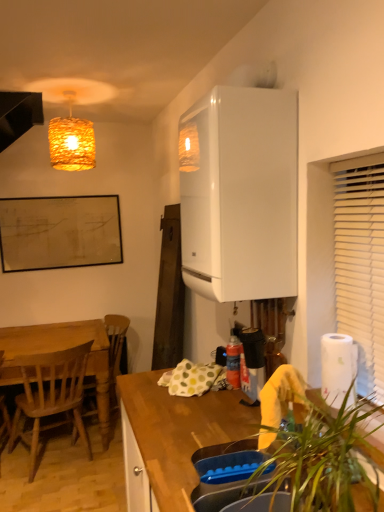
The width and height of the screenshot is (384, 512). What are the coordinates of `white glossy boiler at upper right` in the screenshot? It's located at (240, 194).

Find the location of a particular element. This screenshot has width=384, height=512. wooden chair at left, the first chair when ordered from back to front is located at coordinates (116, 343).

From the image's perspective, which one is positioned lower, woven straw lampshade at upper left or white glossy boiler at upper right?

From the image's view, white glossy boiler at upper right is below.

Is woven straw lampshade at upper left inside the boundaries of white glossy boiler at upper right, or outside?

woven straw lampshade at upper left is not enclosed by white glossy boiler at upper right.

Considering the relative positions of woven straw lampshade at upper left and white glossy boiler at upper right in the image provided, is woven straw lampshade at upper left to the left of white glossy boiler at upper right from the viewer's perspective?

Indeed, woven straw lampshade at upper left is positioned on the left side of white glossy boiler at upper right.

Considering the relative sizes of woven straw lampshade at upper left and white glossy boiler at upper right in the image provided, is woven straw lampshade at upper left taller than white glossy boiler at upper right?

No.

Considering the sizes of objects wooden at lower right and black matte exhaust hood at upper left in the image provided, who is taller, wooden at lower right or black matte exhaust hood at upper left?

With more height is wooden at lower right.

I want to click on exhaust hood to the left of wooden at lower right, so click(x=18, y=115).

Is wooden at lower right wider than black matte exhaust hood at upper left?

Correct, the width of wooden at lower right exceeds that of black matte exhaust hood at upper left.

Is white glossy boiler at upper right facing away from wooden chair at left, the second chair in the front-to-back sequence?

No, wooden chair at left, the second chair in the front-to-back sequence, is not at the back of white glossy boiler at upper right.

Is white glossy boiler at upper right to the left of wooden chair at left, the second chair in the front-to-back sequence, from the viewer's perspective?

No.

From the white glossy boiler at upper right, count the 1st chair to the left and point to it. Please provide its 2D coordinates.

[(116, 343)]

In the scene shown: Is white glossy boiler at upper right far away from wooden chair at left, the first chair when ordered from back to front?

white glossy boiler at upper right is far away from wooden chair at left, the first chair when ordered from back to front.

From the white paper at right, count 2nd chairs backward and point to it. Please provide its 2D coordinates.

[(116, 343)]

In terms of size, does white paper at right appear bigger or smaller than wooden chair at left, the second chair in the front-to-back sequence?

white paper at right is smaller than wooden chair at left, the second chair in the front-to-back sequence.

Is white paper at right further to camera compared to wooden chair at left, the second chair in the front-to-back sequence?

That is False.

Which is closer, (212, 92) or (30, 98)?

Point (212, 92) appears to be closer to the viewer than point (30, 98).

Is white glossy boiler at upper right further to camera compared to black matte exhaust hood at upper left?

That is False.

Considering the sizes of objects white glossy boiler at upper right and black matte exhaust hood at upper left in the image provided, who is wider, white glossy boiler at upper right or black matte exhaust hood at upper left?

Wider between the two is white glossy boiler at upper right.

Where is `exhaust hood behind the white glossy boiler at upper right`? The height and width of the screenshot is (512, 384). exhaust hood behind the white glossy boiler at upper right is located at coordinates (18, 115).

How distant is white glossy boiler at upper right from white paper at right?

They are 22.47 inches apart.

Does white glossy boiler at upper right turn towards white paper at right?

No, white glossy boiler at upper right is not oriented towards white paper at right.

Based on the photo, can you confirm if white glossy boiler at upper right is positioned to the left of white paper at right?

Indeed, white glossy boiler at upper right is positioned on the left side of white paper at right.

Is white glossy boiler at upper right directly adjacent to white paper at right?

No, white glossy boiler at upper right is not in contact with white paper at right.

Does wooden chair at left, the second chair in the front-to-back sequence, have a greater height compared to white glossy boiler at upper right?

Correct, wooden chair at left, the second chair in the front-to-back sequence, is much taller as white glossy boiler at upper right.

Does wooden chair at left, the first chair when ordered from back to front, touch white glossy boiler at upper right?

No, wooden chair at left, the first chair when ordered from back to front, is not making contact with white glossy boiler at upper right.

Which object is positioned more to the left, wooden chair at left, the first chair when ordered from back to front, or white glossy boiler at upper right?

Positioned to the left is wooden chair at left, the first chair when ordered from back to front.

This screenshot has width=384, height=512. There is a white glossy boiler at upper right. Find the location of `lamp above it (from a real-world perspective)`. lamp above it (from a real-world perspective) is located at coordinates (71, 141).

The height and width of the screenshot is (512, 384). What are the coordinates of `countertop that appears in front of the black matte exhaust hood at upper left` in the screenshot? It's located at (173, 437).

From the image, which object appears to be farther from wooden at lower right, white paper at right or white glossy boiler at upper right?

white glossy boiler at upper right is positioned further to the anchor wooden at lower right.

From the image, which object appears to be farther from white glossy boiler at upper right, wooden at lower right or wooden chair at left, which is the 1th chair from front to back?

Among the two, wooden chair at left, which is the 1th chair from front to back, is located further to white glossy boiler at upper right.

Based on their spatial positions, is black matte exhaust hood at upper left or white paper at right closer to wooden chair at left, the first chair when ordered from back to front?

Among the two, black matte exhaust hood at upper left is located nearer to wooden chair at left, the first chair when ordered from back to front.

Which object lies nearer to the anchor point white glossy boiler at upper right, white paper at right or wooden at lower right?

white paper at right is positioned closer to the anchor white glossy boiler at upper right.

When comparing their distances from white paper at right, does wooden at lower right or woven straw lampshade at upper left seem closer?

The object closer to white paper at right is wooden at lower right.

When comparing their distances from wooden at lower right, does woven straw lampshade at upper left or wooden chair at left, the second chair in the front-to-back sequence, seem further?

woven straw lampshade at upper left.

Considering their positions, is white paper at right positioned further to wooden at lower right than wooden chair at left, the second chair from the back?

Among the two, wooden chair at left, the second chair from the back, is located further to wooden at lower right.

When comparing their distances from wooden chair at left, which is the 1th chair from front to back, does black matte exhaust hood at upper left or wooden chair at left, the second chair in the front-to-back sequence, seem further?

black matte exhaust hood at upper left is further to wooden chair at left, which is the 1th chair from front to back.

I want to click on lamp located between wooden at lower right and wooden chair at left, the first chair when ordered from back to front, in the depth direction, so click(x=71, y=141).

I want to click on lamp between white glossy boiler at upper right and black matte exhaust hood at upper left in the front-back direction, so 71,141.

Where is `paper towel that lies between black matte exhaust hood at upper left and wooden chair at left, which is the 1th chair from front to back, from top to bottom`? This screenshot has height=512, width=384. paper towel that lies between black matte exhaust hood at upper left and wooden chair at left, which is the 1th chair from front to back, from top to bottom is located at coordinates (337, 367).

The width and height of the screenshot is (384, 512). In order to click on lamp between black matte exhaust hood at upper left and white paper at right in this screenshot , I will do `click(71, 141)`.